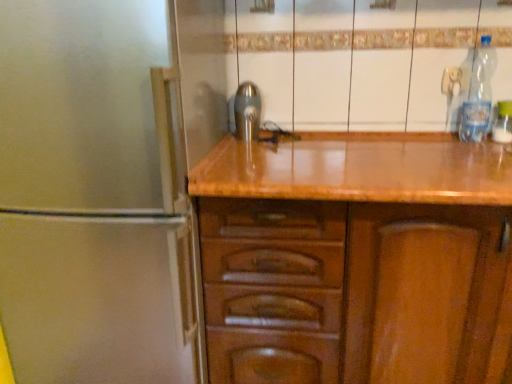
Question: From the image's perspective, is clear plastic bottle at upper right, the second bottle from the right, positioned above or below clear plastic bottle at right, which is counted as the 1th bottle, starting from the right?

Choices:
 (A) below
 (B) above

Answer: (B)

Question: From a real-world perspective, is clear plastic bottle at upper right, the second bottle from the right, above or below clear plastic bottle at right, the 2th bottle positioned from the left?

Choices:
 (A) below
 (B) above

Answer: (B)

Question: Which object is the farthest from the clear plastic bottle at upper right, which ranks as the 1th bottle in left-to-right order?

Choices:
 (A) clear plastic bottle at right, which is counted as the 1th bottle, starting from the right
 (B) polished metallic tap at center

Answer: (B)

Question: Which of these objects is positioned closest to the clear plastic bottle at right, which is counted as the 1th bottle, starting from the right?

Choices:
 (A) polished metallic tap at center
 (B) clear plastic bottle at upper right, which ranks as the 1th bottle in left-to-right order

Answer: (B)